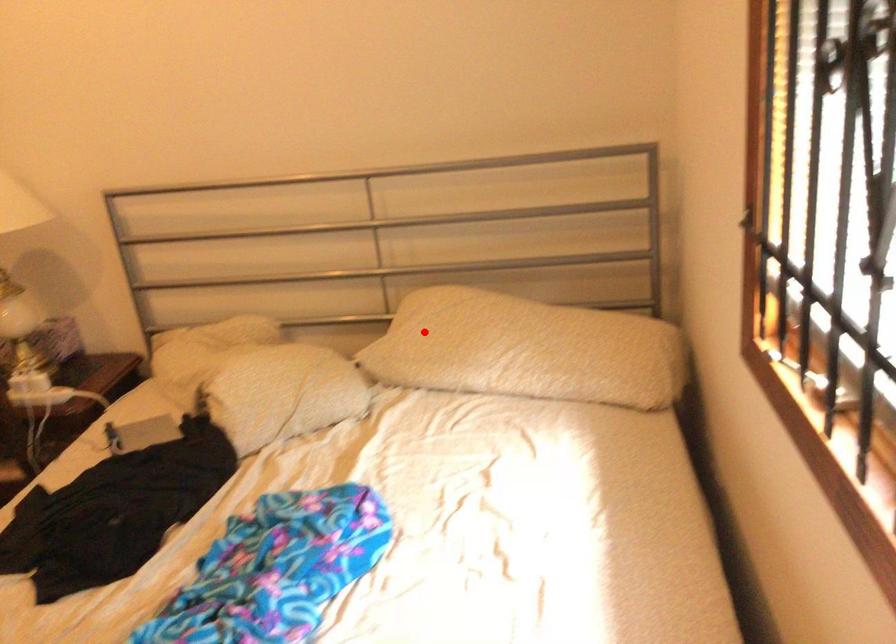
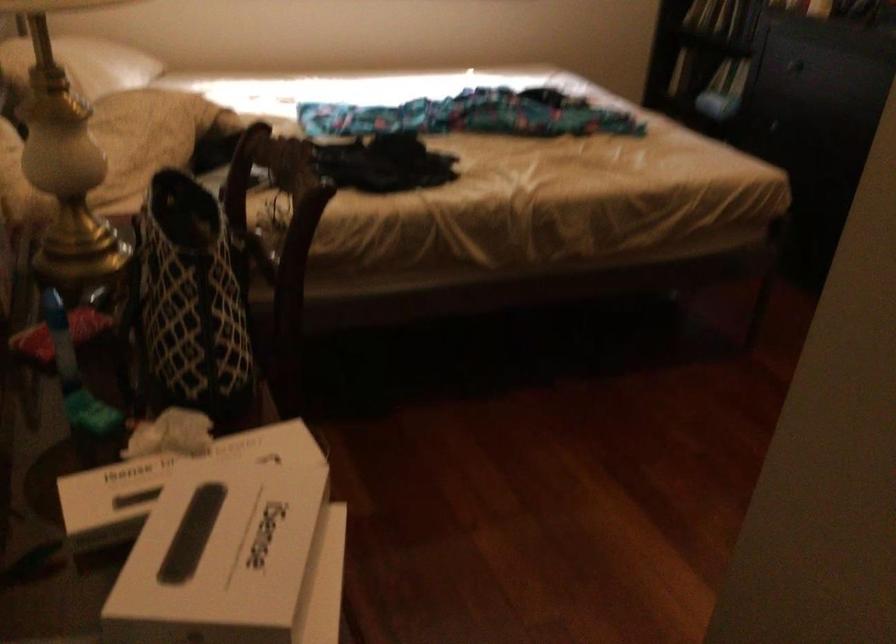
The point at the highlighted location is marked in the first image. Where is the corresponding point in the second image?

(82, 64)